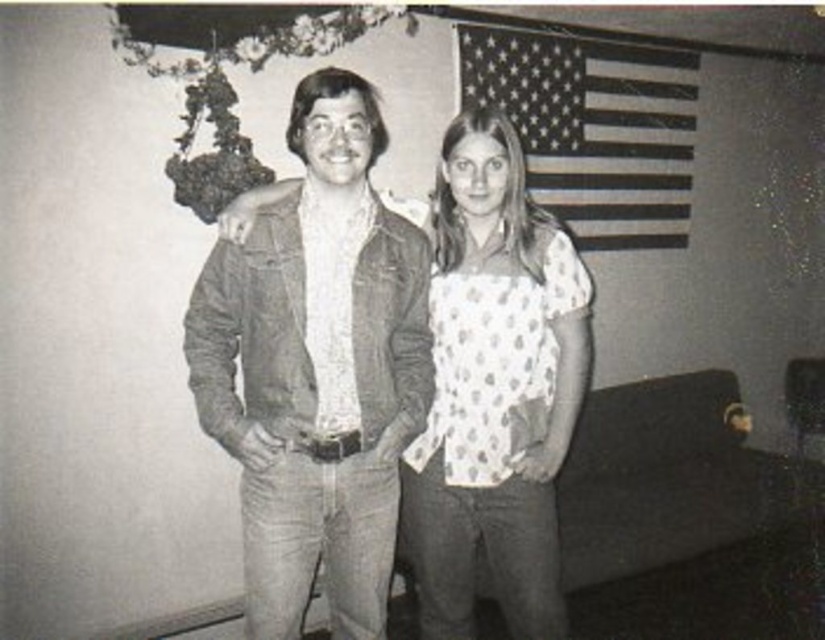
You are a photographer trying to capture a closeup of the floral design on the wall. You notice the denim jacket at center and the white dotted blouse at center are blocking your view. Which object should you move to the right to get a clearer shot of the floral design?

You should move the denim jacket at center to the right since it is currently positioned to the left of the white dotted blouse at center, and moving it would clear the path towards the floral design on the wall.

In the image described, where is the denim jacket at center located in terms of coordinates?

The denim jacket at center is located at point [317,369].

You are a tailor who needs to measure the denim jacket at center and the white dotted blouse at center for alterations. Which garment is currently covering the other one?

The denim jacket at center is positioned over the white dotted blouse at center, so the denim jacket is covering the blouse.